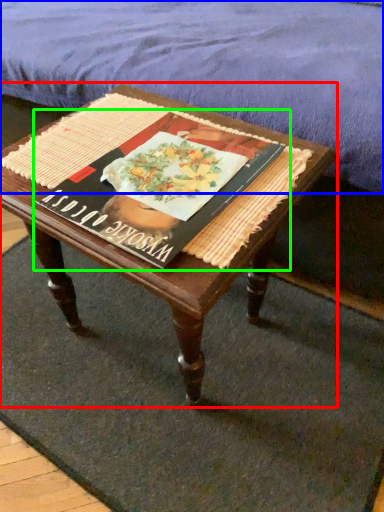
Question: Estimate the real-world distances between objects in this image. Which object is farther from coffee table (highlighted by a red box), mattress (highlighted by a blue box) or paperback book (highlighted by a green box)?

Choices:
 (A) mattress
 (B) paperback book

Answer: (A)